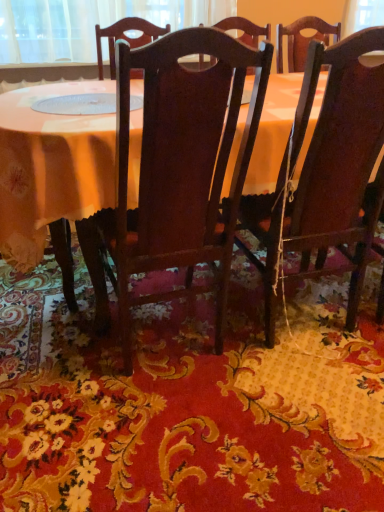
Question: Is floral carpet at center inside the boundaries of dark wood chair at right, placed as the first chair when sorted from right to left, or outside?

Choices:
 (A) outside
 (B) inside

Answer: (A)

Question: From a real-world perspective, is floral carpet at center positioned above or below dark wood chair at right, placed as the 2th chair when sorted from left to right?

Choices:
 (A) above
 (B) below

Answer: (B)

Question: Based on their relative distances, which object is farther from the dark wood chair at right, placed as the 2th chair when sorted from left to right?

Choices:
 (A) floral carpet at center
 (B) dark wood chair at center, the 2th chair from the right
 (C) wooden table at center

Answer: (C)

Question: Based on their relative distances, which object is nearer to the floral carpet at center?

Choices:
 (A) dark wood chair at center, the 2th chair from the right
 (B) wooden table at center
 (C) dark wood chair at right, placed as the 2th chair when sorted from left to right

Answer: (A)